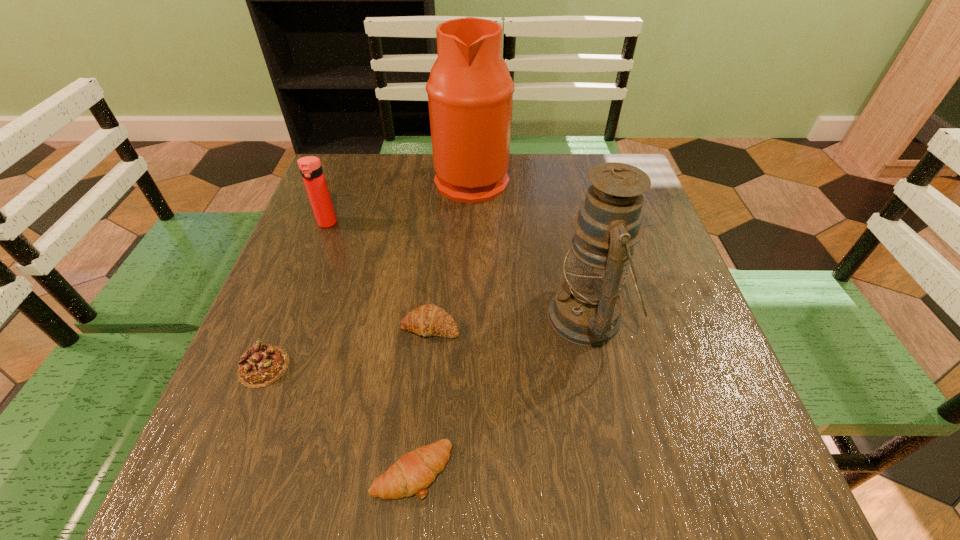
Where is `vacant space in between the fifth shortest object and the nearest object`? This screenshot has height=540, width=960. vacant space in between the fifth shortest object and the nearest object is located at coordinates (500, 394).

Find the location of `free space between the fifth shortest object and the thermos bottle`. free space between the fifth shortest object and the thermos bottle is located at coordinates [x=458, y=270].

Where is `free spot between the second farthest object and the water jug`? This screenshot has width=960, height=540. free spot between the second farthest object and the water jug is located at coordinates [x=399, y=201].

Choose which object is the fourth nearest neighbor to the water jug. Please provide its 2D coordinates. Your answer should be formatted as a tuple, i.e. [(x, y)], where the tuple contains the x and y coordinates of a point satisfying the conditions above.

[(261, 365)]

Select which object appears as the fifth closest to the farther crescent roll. Please provide its 2D coordinates. Your answer should be formatted as a tuple, i.e. [(x, y)], where the tuple contains the x and y coordinates of a point satisfying the conditions above.

[(470, 91)]

The image size is (960, 540). What are the coordinates of `free point that satisfies the following two spatial constraints: 1. on the back side of the chocolate cake; 2. on the left side of the farther crescent roll` in the screenshot? It's located at point(280,326).

At what (x,y) coordinates should I click in order to perform the action: click on vacant space that satisfies the following two spatial constraints: 1. from the spout of the farthest object; 2. on the left side of the rightmost object. Please return your answer as a coordinate pair (x, y). This screenshot has height=540, width=960. Looking at the image, I should click on (468, 316).

The image size is (960, 540). I want to click on vacant space that satisfies the following two spatial constraints: 1. on the front side of the fifth nearest object; 2. on the left side of the farther crescent roll, so click(x=288, y=326).